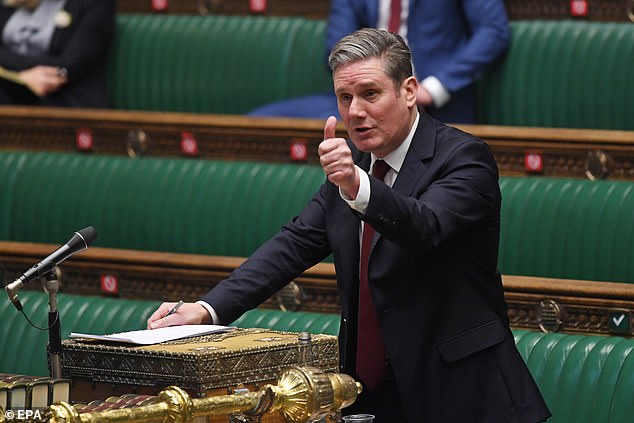
What are the coordinates of `table` in the screenshot? It's located at (231, 379).